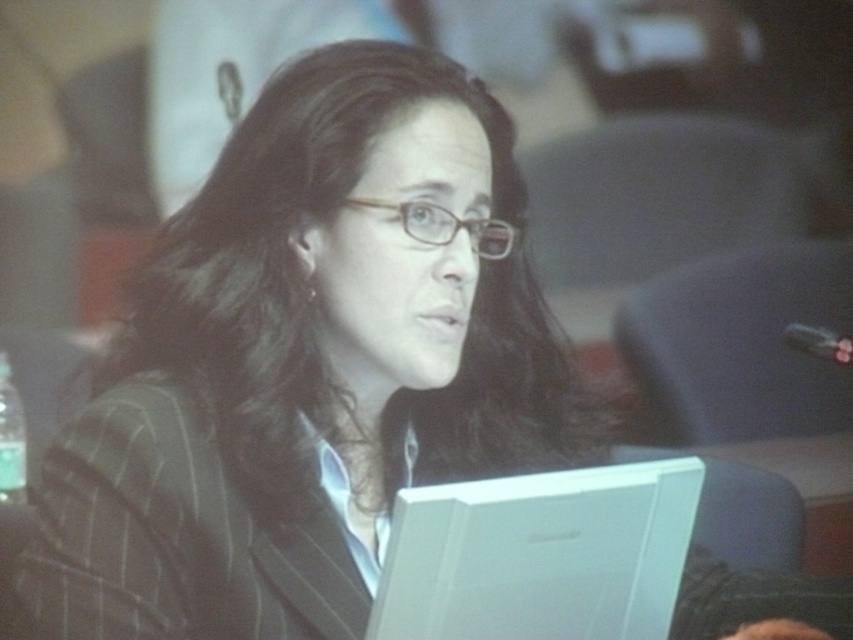
Question: Which point is closer to the camera taking this photo?

Choices:
 (A) (109, 529)
 (B) (260, 218)

Answer: (A)

Question: Is dark brown silky hair at center smaller than clear plastic glasses at center?

Choices:
 (A) no
 (B) yes

Answer: (A)

Question: Which object appears closest to the camera in this image?

Choices:
 (A) clear plastic glasses at center
 (B) striped wool business suit at center
 (C) white plastic laptop at lower center
 (D) dark brown silky hair at center

Answer: (C)

Question: In this image, where is dark brown silky hair at center located relative to white plastic laptop at lower center?

Choices:
 (A) left
 (B) right

Answer: (A)

Question: Which of these objects is positioned farthest from the striped wool business suit at center?

Choices:
 (A) clear plastic glasses at center
 (B) white plastic laptop at lower center
 (C) dark brown silky hair at center

Answer: (A)

Question: Is dark brown silky hair at center behind clear plastic glasses at center?

Choices:
 (A) no
 (B) yes

Answer: (A)